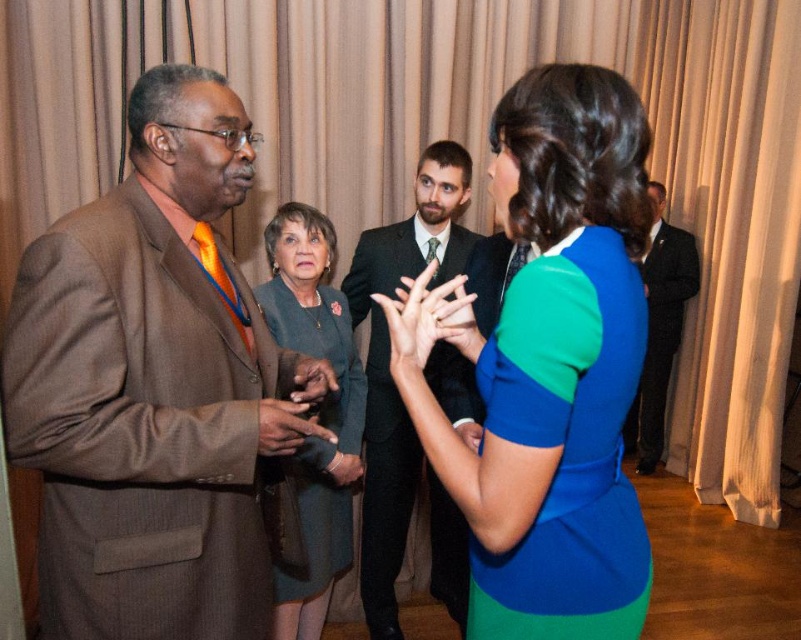
Does black suit at center appear over dark suit at right?

Actually, black suit at center is below dark suit at right.

What do you see at coordinates (388, 362) in the screenshot? I see `black suit at center` at bounding box center [388, 362].

Locate an element on the screen. Image resolution: width=801 pixels, height=640 pixels. black suit at center is located at coordinates (388, 362).

Does dark suit at right appear on the right side of brown leather glove at center?

Correct, you'll find dark suit at right to the right of brown leather glove at center.

Measure the distance between dark suit at right and camera.

dark suit at right and camera are 13.88 feet apart from each other.

This screenshot has height=640, width=801. I want to click on dark suit at right, so click(659, 326).

Consider the image. Does brown pinstripe suit at left lie in front of blue matte dress at center?

No, it is behind blue matte dress at center.

Can you confirm if brown pinstripe suit at left is positioned below blue matte dress at center?

Incorrect, brown pinstripe suit at left is not positioned below blue matte dress at center.

Locate an element on the screen. This screenshot has width=801, height=640. brown pinstripe suit at left is located at coordinates (147, 385).